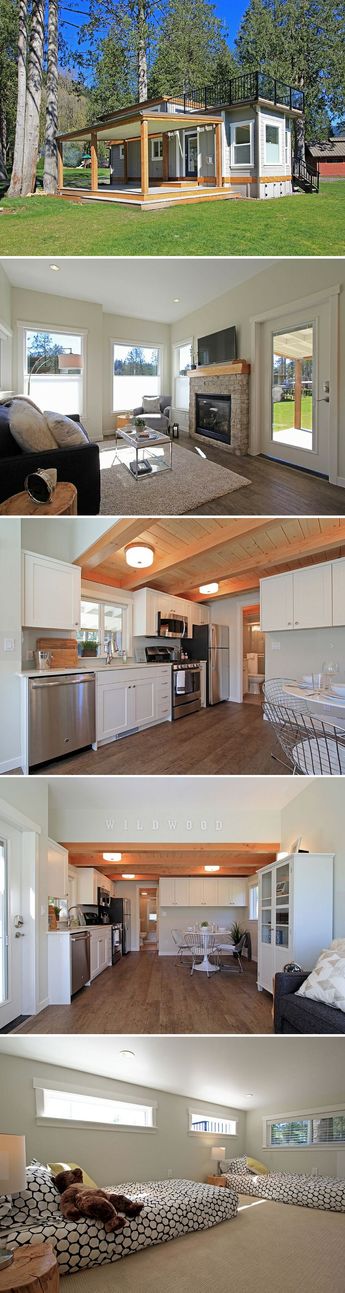
Find the location of `lighting`. lighting is located at coordinates (16, 1165), (214, 868), (115, 857), (127, 875), (215, 586), (145, 561), (177, 299), (53, 268), (69, 357).